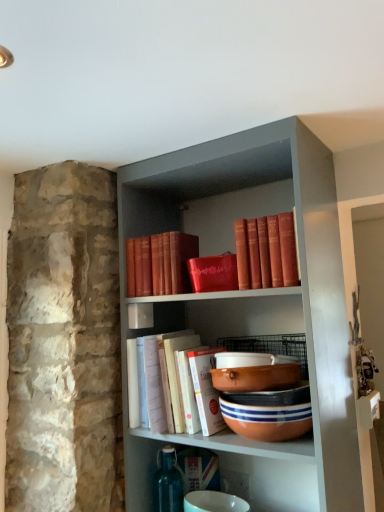
In order to click on free space above matte orange bowl at center, which is counted as the 3th bowl, starting from the bottom (from a real-world perspective) in this screenshot , I will do `click(250, 359)`.